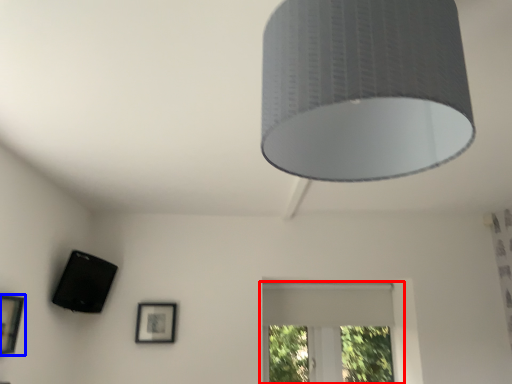
Question: Among these objects, which one is farthest to the camera, window (highlighted by a red box) or picture frame (highlighted by a blue box)?

Choices:
 (A) window
 (B) picture frame

Answer: (A)